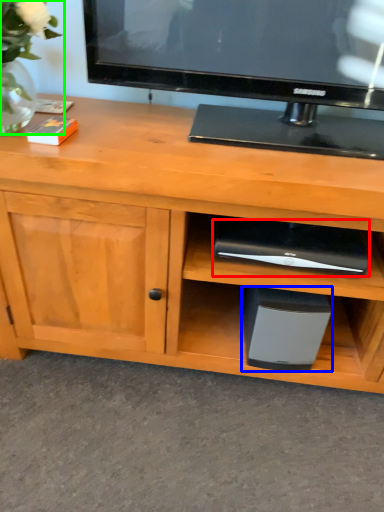
Question: Which object is the farthest from appliance (highlighted by a red box)? Choose among these: appliance (highlighted by a blue box) or floral arrangement (highlighted by a green box).

Choices:
 (A) appliance
 (B) floral arrangement

Answer: (B)